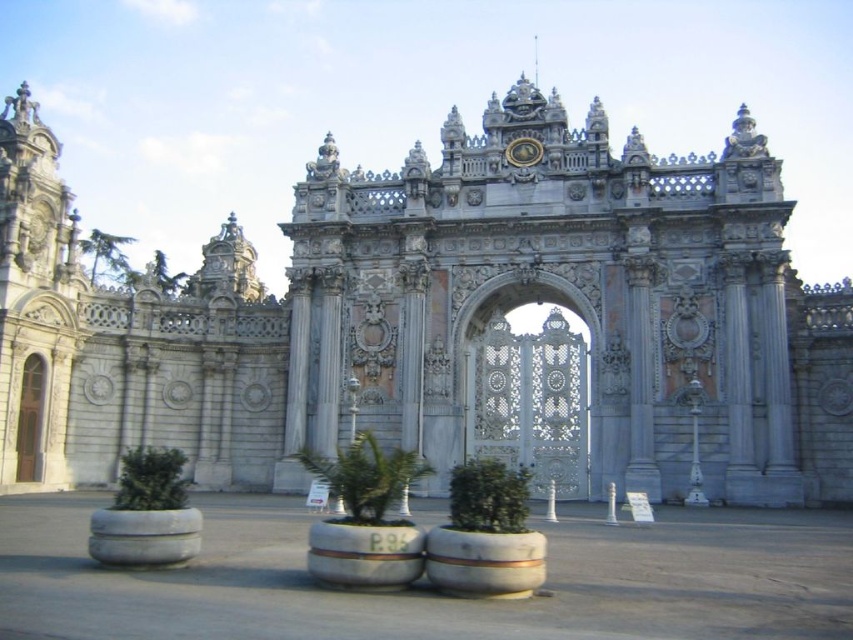
What are the coordinates of `white stone gate at center` in the screenshot? It's located at (445, 316).

Does white stone gate at center appear over wooden door at left?

Yes.

I want to click on white stone gate at center, so click(x=445, y=316).